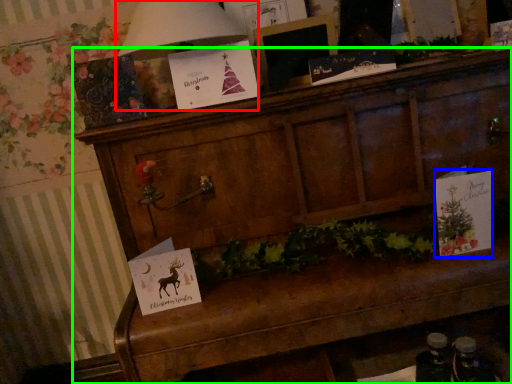
Question: Which object is the closest to the lamp (highlighted by a red box)? Choose among these: christmas card (highlighted by a blue box) or furniture (highlighted by a green box).

Choices:
 (A) christmas card
 (B) furniture

Answer: (B)